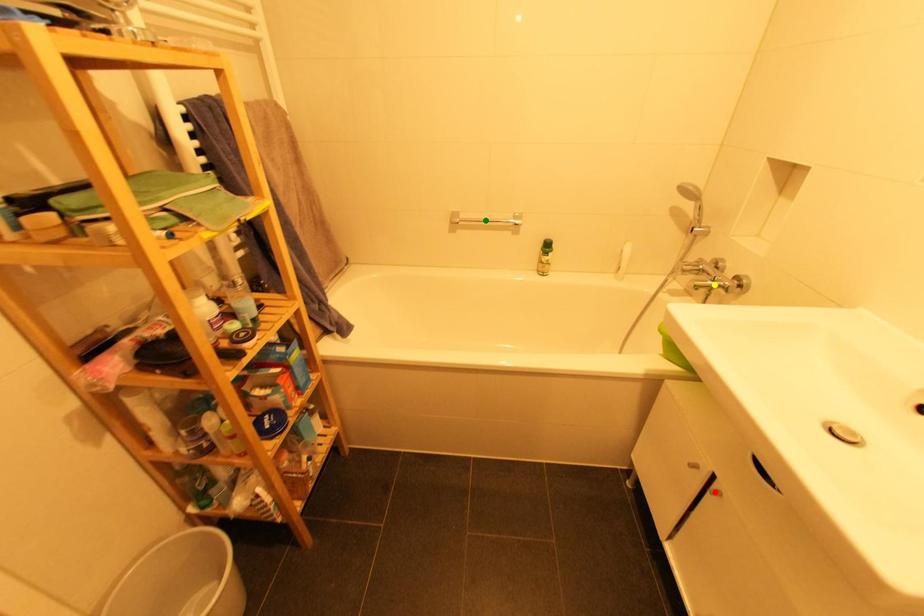
Based on the photo, order these from farthest to nearest:
green point, red point, yellow point

green point
yellow point
red point